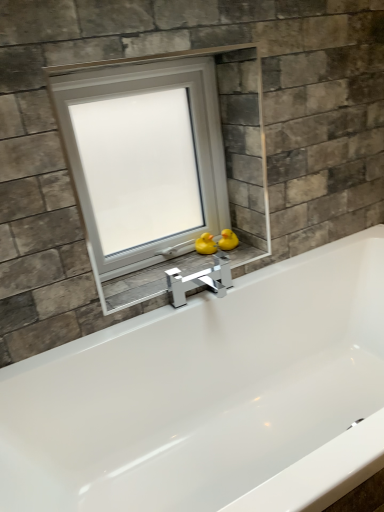
The height and width of the screenshot is (512, 384). Identify the location of unoccupied region to the right of yellow rubber duck at center, acting as the 1th duck starting from the left. (242, 254).